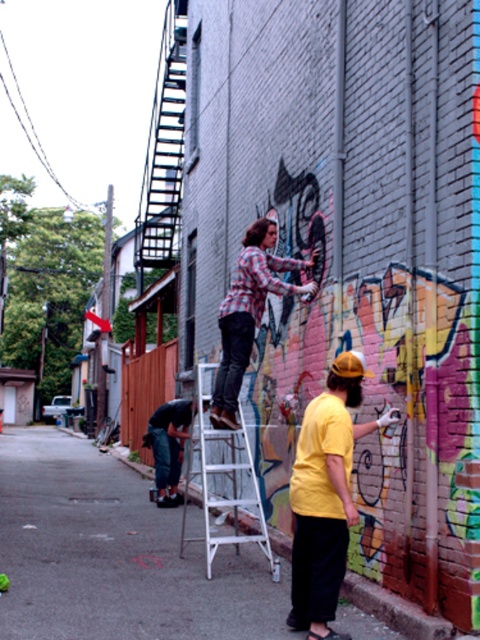
You are standing in the alleyway and notice two points on the graffiti wall. The first point is at coordinates point (225, 500) and the second is at point (188, 400). Which point is closer to you?

Point (225, 500) is closer to the viewer than point (188, 400).

You are a painter trying to reach the top of the brick wall to add a finishing touch to the graffiti. The matte white ladder at center is positioned at point 0.867, 0.240. Is the ladder placed in a suitable location to reach the highest part of the wall?

The matte white ladder at center is positioned at point (115, 554), which is the correct location to reach the highest part of the wall.